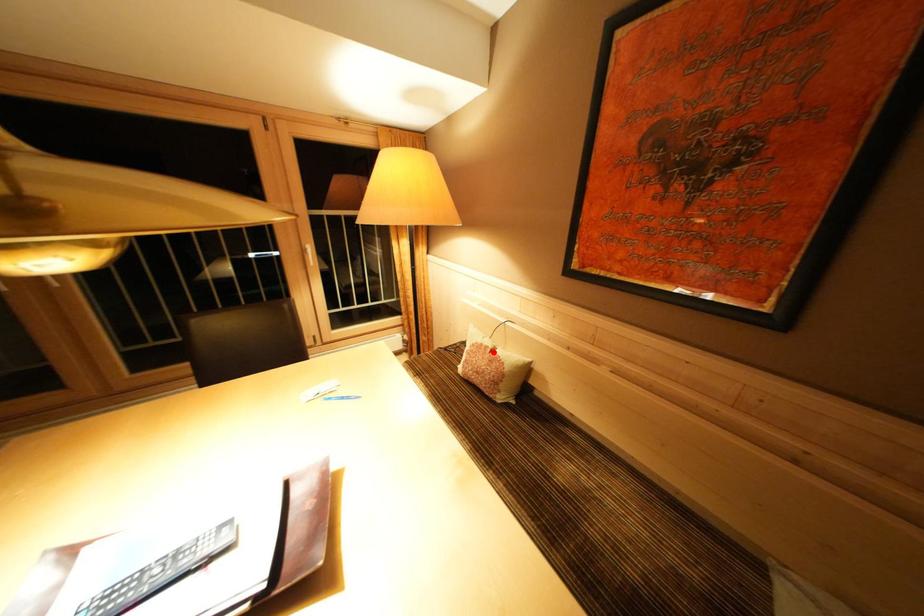
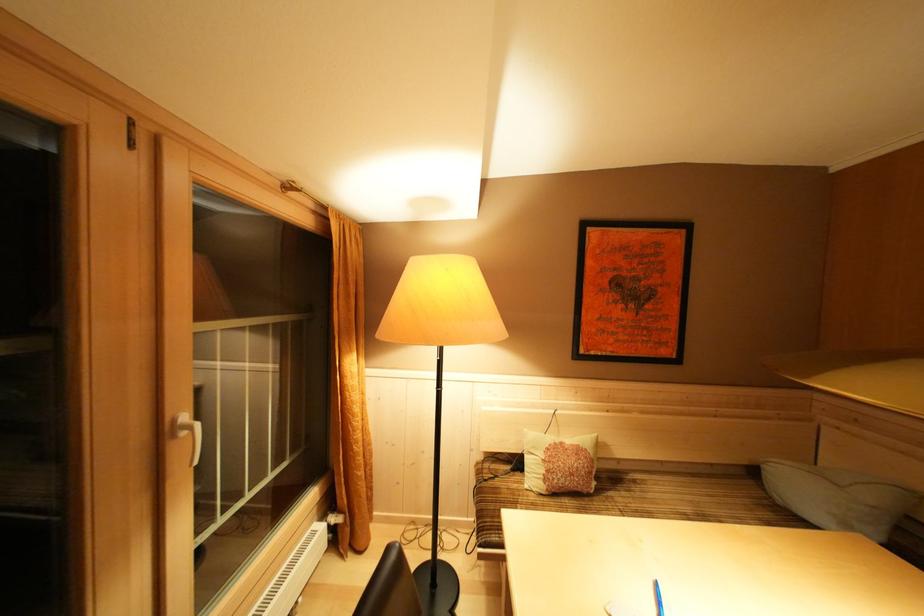
Question: I am providing you with two images of the same scene from different viewpoints. In image1, a red point is highlighted. Considering the same 3D point in image2, which of the following is correct?

Choices:
 (A) It is closer
 (B) It is farther

Answer: (B)